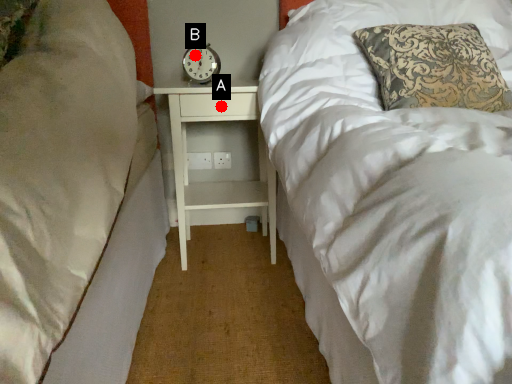
Question: Two points are circled on the image, labeled by A and B beside each circle. Among these points, which one is farthest from the camera?

Choices:
 (A) A is further
 (B) B is further

Answer: (B)